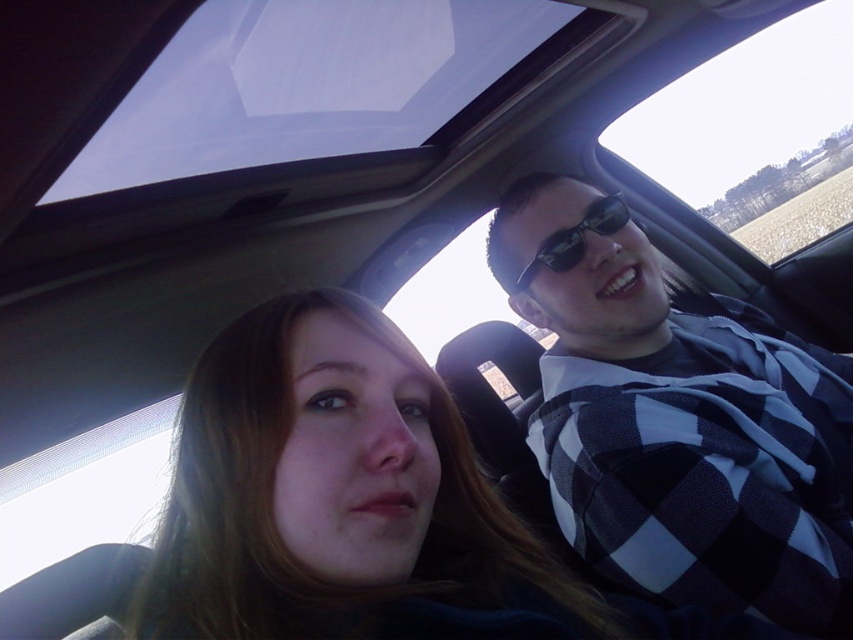
Question: Estimate the real-world distances between objects in this image. Which object is closer to the black checkered shirt at right?

Choices:
 (A) black plastic sunglasses at upper right
 (B) smooth brown hair at center

Answer: (A)

Question: Is black checkered shirt at right to the right of smooth brown hair at center from the viewer's perspective?

Choices:
 (A) no
 (B) yes

Answer: (B)

Question: Which of the following is the closest to the observer?

Choices:
 (A) black checkered shirt at right
 (B) smooth brown hair at center
 (C) black plastic sunglasses at upper right

Answer: (B)

Question: Is black checkered shirt at right closer to camera compared to smooth brown hair at center?

Choices:
 (A) yes
 (B) no

Answer: (B)

Question: Is black checkered shirt at right smaller than black plastic sunglasses at upper right?

Choices:
 (A) no
 (B) yes

Answer: (A)

Question: Which of the following is the farthest from the observer?

Choices:
 (A) [x=606, y=234]
 (B) [x=561, y=572]

Answer: (A)